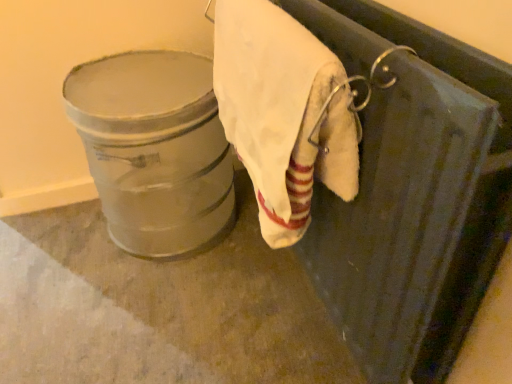
Question: Is white cotton towel at upper right thinner than metallic silver bucket at left?

Choices:
 (A) yes
 (B) no

Answer: (A)

Question: Is white cotton towel at upper right behind metallic silver bucket at left?

Choices:
 (A) no
 (B) yes

Answer: (A)

Question: Can you confirm if white cotton towel at upper right is wider than metallic silver bucket at left?

Choices:
 (A) no
 (B) yes

Answer: (A)

Question: Considering the relative sizes of white cotton towel at upper right and metallic silver bucket at left in the image provided, is white cotton towel at upper right shorter than metallic silver bucket at left?

Choices:
 (A) no
 (B) yes

Answer: (B)

Question: Is white cotton towel at upper right bigger than metallic silver bucket at left?

Choices:
 (A) yes
 (B) no

Answer: (B)

Question: Would you say metallic silver bucket at left is part of white cotton towel at upper right's contents?

Choices:
 (A) no
 (B) yes

Answer: (A)

Question: Can we say metallic silver bucket at left lies outside white cotton towel at upper right?

Choices:
 (A) yes
 (B) no

Answer: (A)

Question: From a real-world perspective, is metallic silver bucket at left located higher than white cotton towel at upper right?

Choices:
 (A) no
 (B) yes

Answer: (A)

Question: From a real-world perspective, is metallic silver bucket at left physically below white cotton towel at upper right?

Choices:
 (A) no
 (B) yes

Answer: (B)

Question: Can you confirm if metallic silver bucket at left is taller than white cotton towel at upper right?

Choices:
 (A) no
 (B) yes

Answer: (B)

Question: From the image's perspective, would you say metallic silver bucket at left is positioned over white cotton towel at upper right?

Choices:
 (A) no
 (B) yes

Answer: (A)

Question: Does metallic silver bucket at left have a larger size compared to white cotton towel at upper right?

Choices:
 (A) yes
 (B) no

Answer: (A)

Question: Is metallic silver bucket at left bigger or smaller than white cotton towel at upper right?

Choices:
 (A) big
 (B) small

Answer: (A)